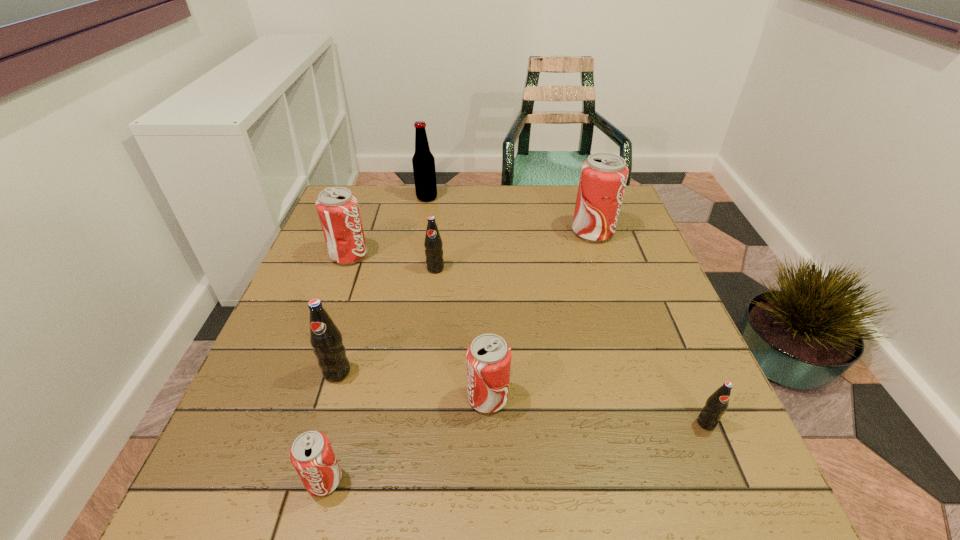
The image size is (960, 540). What are the coordinates of `free space located on the front label of the nearest black pop` in the screenshot? It's located at (742, 507).

Find the location of a particular element. The image size is (960, 540). vacant space located on the back of the third pink soda can from right to left is located at coordinates (338, 430).

Identify the location of beer bottle that is at the far edge. pos(423,161).

Locate an element on the screen. The image size is (960, 540). soda can at the far edge is located at coordinates 603,177.

Locate an element on the screen. object at the near edge is located at coordinates (311, 454).

Where is `object that is at the far right corner`? object that is at the far right corner is located at coordinates coord(603,177).

Where is `vacant area at the far edge of the desktop`? vacant area at the far edge of the desktop is located at coordinates (542, 224).

At what (x,y) coordinates should I click in order to perform the action: click on vacant space at the left edge of the desktop. Please return your answer as a coordinate pair (x, y). The width and height of the screenshot is (960, 540). Looking at the image, I should click on (293, 408).

Where is `vacant space at the right edge of the desktop`? The height and width of the screenshot is (540, 960). vacant space at the right edge of the desktop is located at coordinates (642, 233).

Locate an element on the screen. The height and width of the screenshot is (540, 960). vacant space at the far left corner of the desktop is located at coordinates (359, 196).